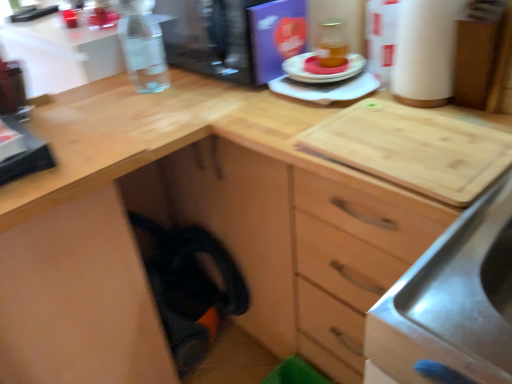
Question: From the image's perspective, is matte orange cake at center over white cardboard paper towel at upper right?

Choices:
 (A) yes
 (B) no

Answer: (B)

Question: Is matte orange cake at center facing towards white cardboard paper towel at upper right?

Choices:
 (A) yes
 (B) no

Answer: (B)

Question: Is the surface of matte orange cake at center in direct contact with white cardboard paper towel at upper right?

Choices:
 (A) yes
 (B) no

Answer: (B)

Question: From a real-world perspective, is matte orange cake at center positioned under white cardboard paper towel at upper right based on gravity?

Choices:
 (A) yes
 (B) no

Answer: (A)

Question: Is matte orange cake at center oriented away from white cardboard paper towel at upper right?

Choices:
 (A) yes
 (B) no

Answer: (B)

Question: Does matte orange cake at center have a lesser width compared to white cardboard paper towel at upper right?

Choices:
 (A) no
 (B) yes

Answer: (B)

Question: Can you confirm if matte orange cake at center is taller than matte plastic plate at center, placed as the first appliance when sorted from bottom to top?

Choices:
 (A) no
 (B) yes

Answer: (A)

Question: Considering the relative sizes of matte orange cake at center and matte plastic plate at center, placed as the first appliance when sorted from bottom to top, in the image provided, is matte orange cake at center bigger than matte plastic plate at center, placed as the first appliance when sorted from bottom to top,?

Choices:
 (A) no
 (B) yes

Answer: (A)

Question: From the image's perspective, would you say matte orange cake at center is shown under matte plastic plate at center, placed as the first appliance when sorted from bottom to top?

Choices:
 (A) no
 (B) yes

Answer: (A)

Question: Can you confirm if matte orange cake at center is positioned to the left of matte plastic plate at center, placed as the first appliance when sorted from bottom to top?

Choices:
 (A) yes
 (B) no

Answer: (A)

Question: Can we say matte orange cake at center lies outside matte plastic plate at center, placed as the first appliance when sorted from bottom to top?

Choices:
 (A) no
 (B) yes

Answer: (B)

Question: Can you confirm if matte orange cake at center is shorter than matte plastic plate at center, placed as the second appliance when sorted from top to bottom?

Choices:
 (A) yes
 (B) no

Answer: (A)

Question: Is matte plastic plate at center, placed as the second appliance when sorted from top to bottom, looking in the opposite direction of transparent plastic water bottle at upper left, placed as the 2th appliance when sorted from bottom to top?

Choices:
 (A) yes
 (B) no

Answer: (B)